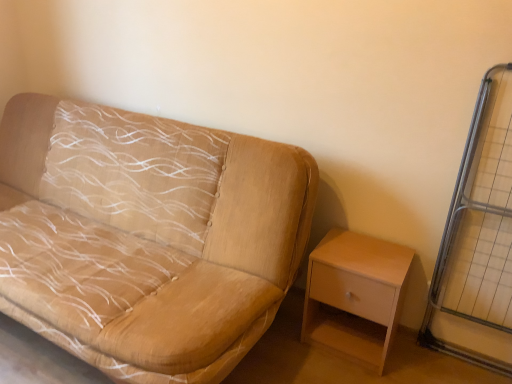
This screenshot has height=384, width=512. I want to click on vacant point to the left of metal grid at right, so click(423, 364).